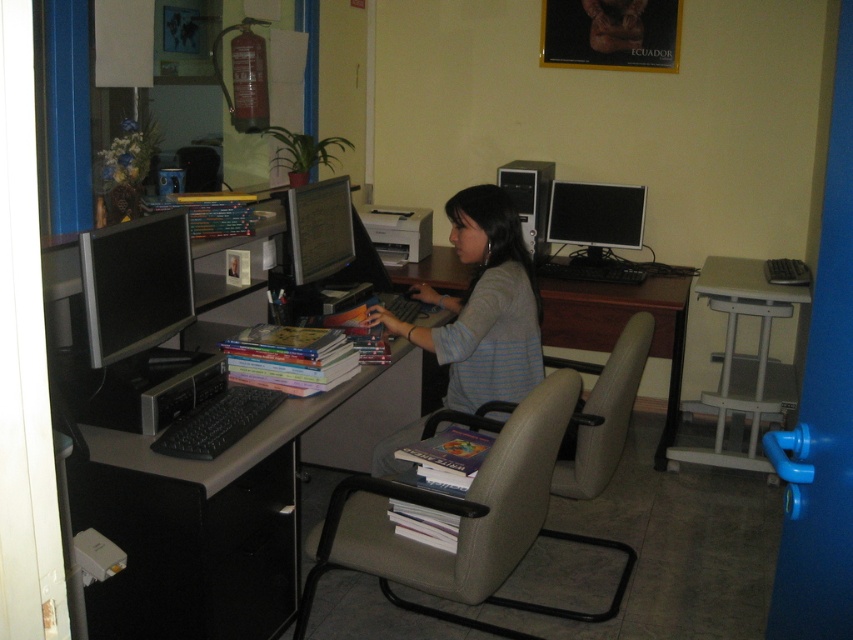
You are an office assistant who needs to locate the gray striped shirt at center in the workspace. Based on the coordinates provided, where exactly should you look to find it?

The gray striped shirt at center is located at coordinates point (482, 307).

You are an office assistant who needs to clean the desk. The gray striped shirt at center and the matte black monitor at center are in the way. Which object should you move first to free up more space?

The gray striped shirt at center is larger in size than the matte black monitor at center, so moving the gray striped shirt at center first would free up more space.

You are organizing a small party in this workspace and want to place a round table between the gray leather swivel chair at center and the gray striped shirt at center. Can the table fit between them?

The gray leather swivel chair at center is positioned on the right side of gray striped shirt at center, so there is space between them for the table to fit.